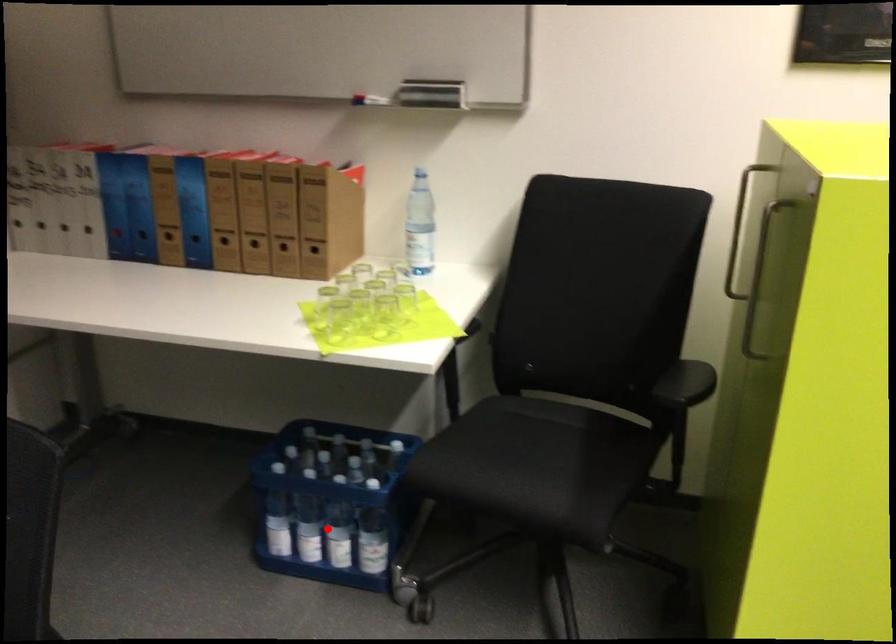
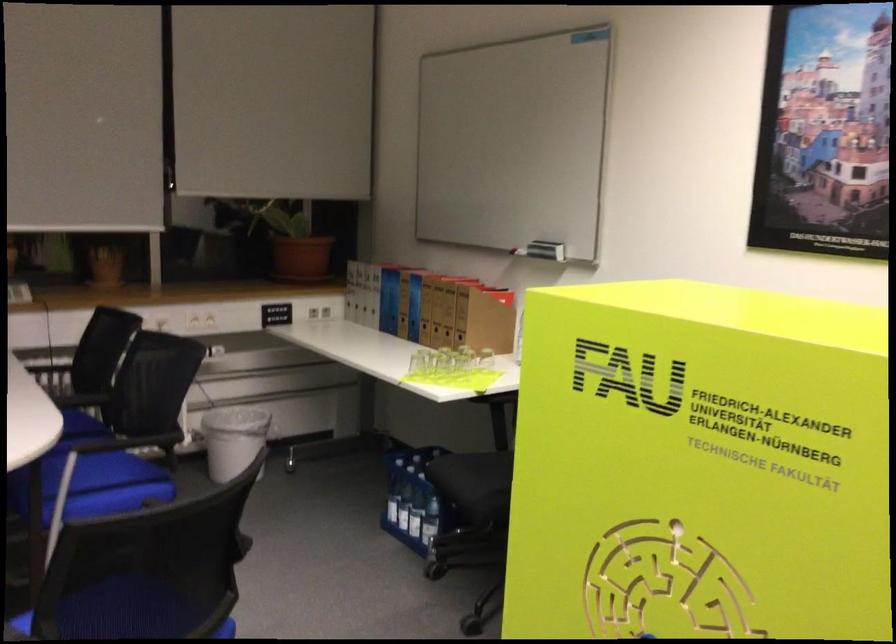
Question: I am providing you with two images of the same scene from different viewpoints. A red point is shown in image1. For the corresponding object point in image2, is it positioned nearer or farther from the camera?

Choices:
 (A) Nearer
 (B) Farther

Answer: (B)